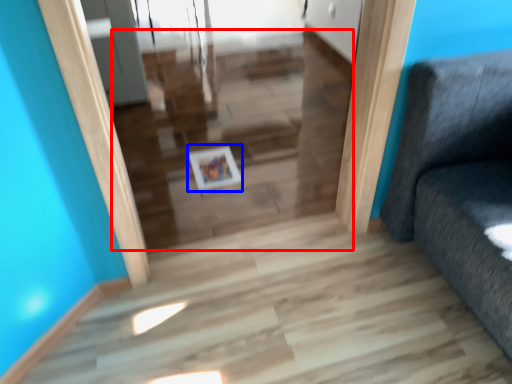
Question: Among these objects, which one is farthest to the camera, stairwell (highlighted by a red box) or picture frame (highlighted by a blue box)?

Choices:
 (A) stairwell
 (B) picture frame

Answer: (B)